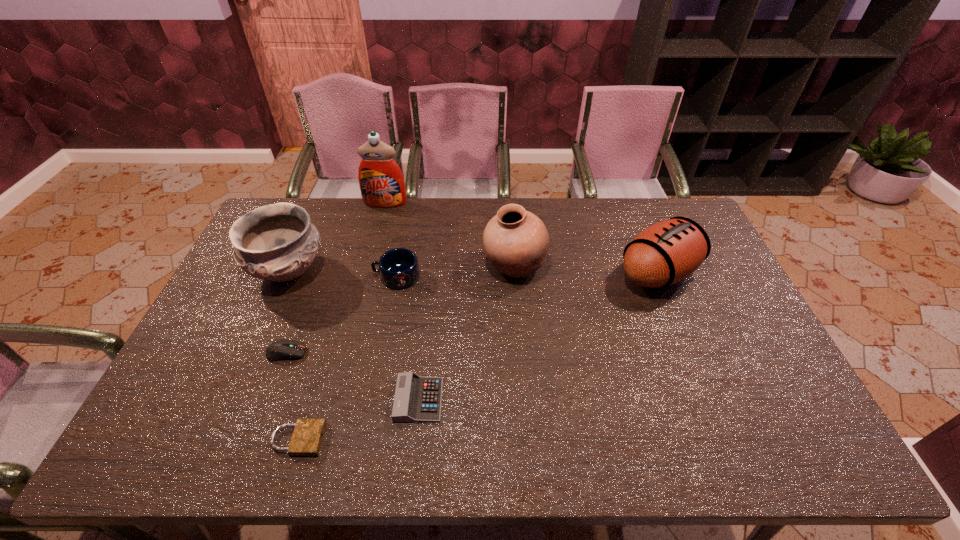
The width and height of the screenshot is (960, 540). I want to click on the farthest object, so click(x=381, y=181).

At what (x,y) coordinates should I click in order to perform the action: click on the tallest object. Please return your answer as a coordinate pair (x, y). Looking at the image, I should click on (381, 181).

This screenshot has width=960, height=540. What are the coordinates of `the right pottery` in the screenshot? It's located at (516, 242).

Identify the location of the shorter pottery. (277, 242).

This screenshot has width=960, height=540. What are the coordinates of `football (American)` in the screenshot? It's located at (667, 252).

Where is `mug`? The height and width of the screenshot is (540, 960). mug is located at coordinates (398, 268).

Where is `the third nearest object`? This screenshot has height=540, width=960. the third nearest object is located at coordinates (279, 350).

Locate an element on the screen. The image size is (960, 540). the second nearest object is located at coordinates (417, 399).

Identify the location of the nearest object. (307, 437).

Locate an element on the screen. padlock is located at coordinates (307, 437).